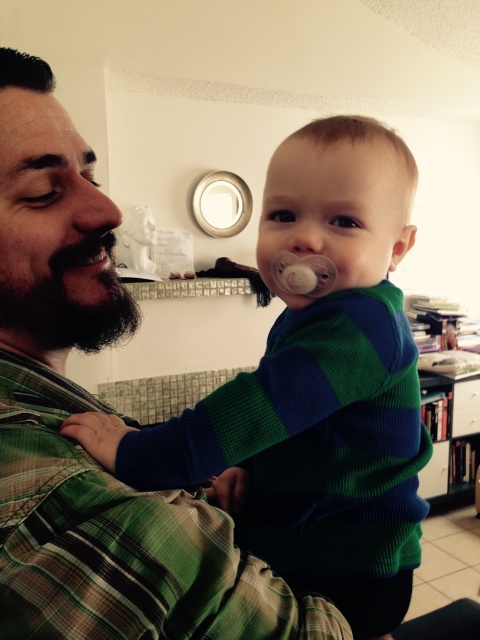
Between black fuzzy beard at left and black matte beard at left, which one has less height?

With less height is black matte beard at left.

Which is more to the left, black fuzzy beard at left or black matte beard at left?

black matte beard at left

Is point (107, 314) positioned after point (95, 269)?

That is True.

I want to click on black fuzzy beard at left, so click(70, 301).

Can you confirm if green striped sweater at upper center is taller than black fuzzy beard at left?

Yes.

Looking at this image, measure the distance between green striped sweater at upper center and camera.

green striped sweater at upper center and camera are 20.54 inches apart.

Is point (249, 518) closer to viewer compared to point (68, 296)?

No.

Identify the location of green striped sweater at upper center. (314, 388).

Is green striped sweater at upper center taller than black matte beard at left?

Correct, green striped sweater at upper center is much taller as black matte beard at left.

Is green striped sweater at upper center further to camera compared to black matte beard at left?

No, green striped sweater at upper center is in front of black matte beard at left.

Is point (213, 394) closer to viewer compared to point (78, 266)?

No.

Identify the location of green striped sweater at upper center. The width and height of the screenshot is (480, 640). (314, 388).